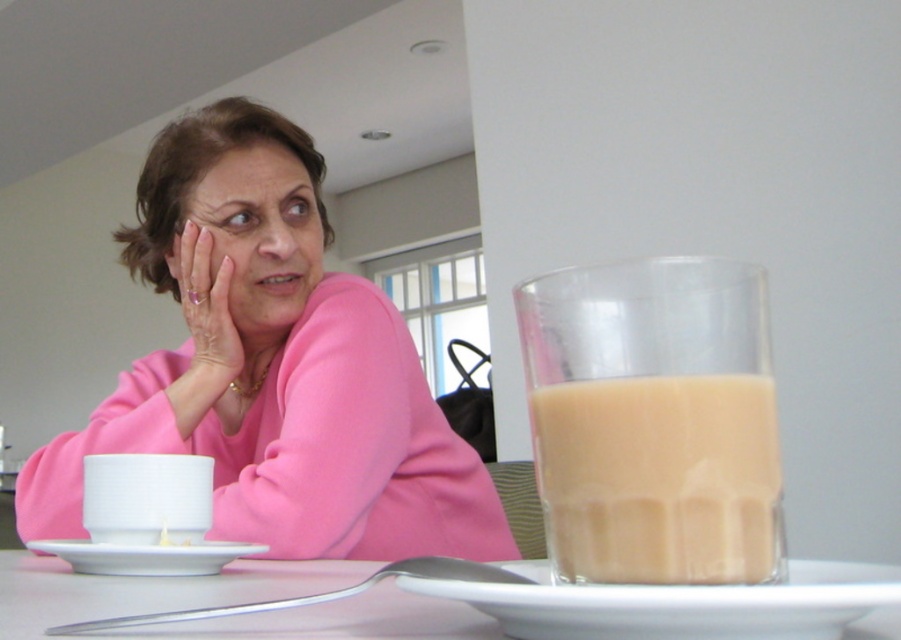
Does matte pink sweater at upper left appear under white glossy saucer at lower left?

Incorrect, matte pink sweater at upper left is not positioned below white glossy saucer at lower left.

Is matte pink sweater at upper left further to the viewer compared to white glossy saucer at lower left?

Yes, matte pink sweater at upper left is behind white glossy saucer at lower left.

Who is more forward, (215, 200) or (139, 547)?

Point (139, 547)

Where is `matte pink sweater at upper left`? matte pink sweater at upper left is located at coordinates (249, 243).

Can you confirm if white ceramic plate at center is smaller than matte pink sweater at upper left?

Yes, white ceramic plate at center is smaller than matte pink sweater at upper left.

Is point (772, 616) less distant than point (226, 243)?

That is True.

Which is in front, point (562, 595) or point (262, 170)?

Point (562, 595) is in front.

Identify the location of white ceramic plate at center. (678, 604).

Can you confirm if matte pink sweater at upper left is positioned to the right of white ceramic cup at lower left?

Incorrect, matte pink sweater at upper left is not on the right side of white ceramic cup at lower left.

Identify the location of matte pink sweater at upper left. (249, 243).